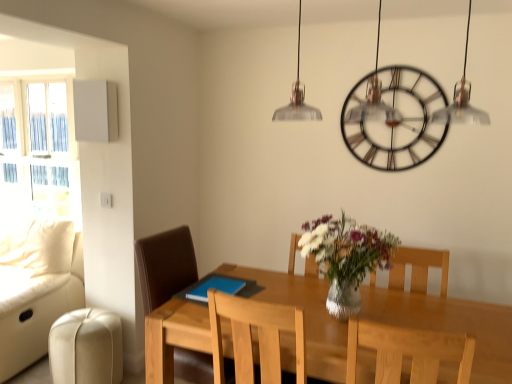
The image size is (512, 384). What are the coordinates of `free point above beige leather swivel chair at lower left (from a real-world perspective)` in the screenshot? It's located at (89, 320).